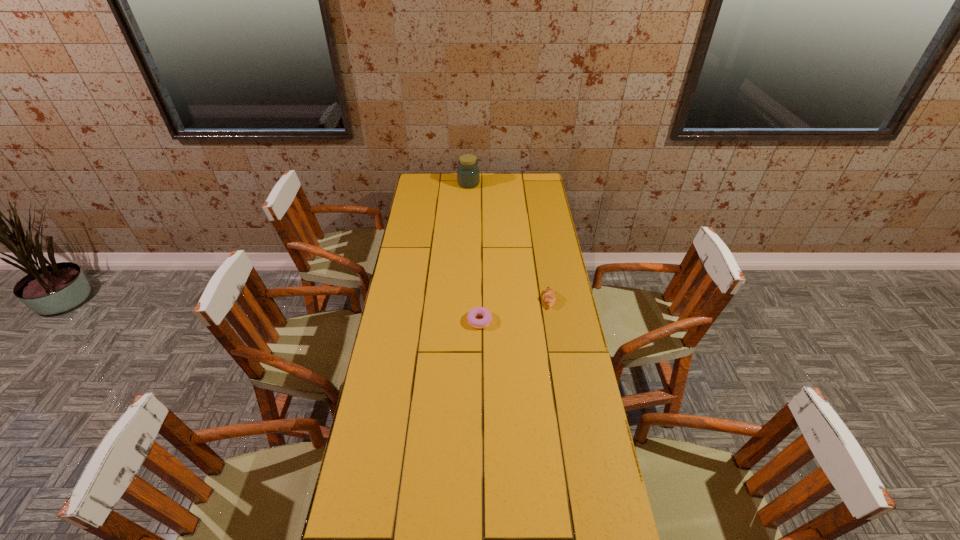
At what (x,y) coordinates should I click in order to perform the action: click on the tallest object. Please return your answer as a coordinate pair (x, y). This screenshot has height=540, width=960. Looking at the image, I should click on (468, 175).

Find the location of a particular element. The image size is (960, 540). jar is located at coordinates [468, 175].

Identify the location of the second farthest object. Image resolution: width=960 pixels, height=540 pixels. (549, 297).

Identify the location of the right pastry. (549, 297).

Where is `the shorter pastry`? Image resolution: width=960 pixels, height=540 pixels. the shorter pastry is located at coordinates (477, 311).

Find the location of a particular element. the nearest object is located at coordinates (477, 311).

You are a GUI agent. You are given a task and a screenshot of the screen. Output one action in this format:
    pyautogui.click(x=<x>, y=<y>)
    Task: Click on the free space located 0.250m on the left of the tallest object
    Image resolution: width=960 pixels, height=540 pixels.
    Given the screenshot: What is the action you would take?
    pyautogui.click(x=414, y=184)

The image size is (960, 540). Identify the location of free space located on the front-facing side of the second farthest object. (496, 300).

Identify the location of free region located 0.300m on the front-facing side of the second farthest object. [469, 300].

The width and height of the screenshot is (960, 540). I want to click on vacant space situated 0.270m on the front-facing side of the second farthest object, so click(x=477, y=300).